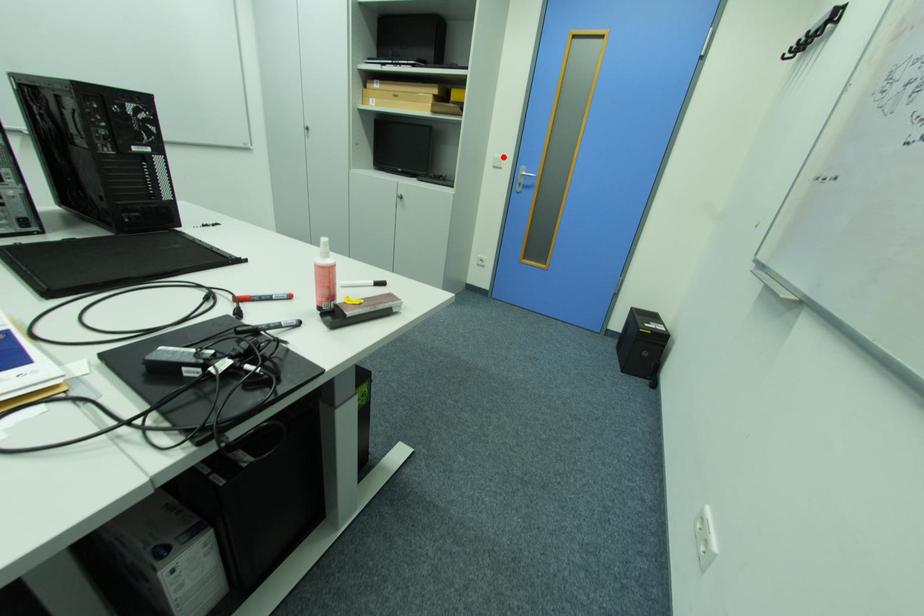
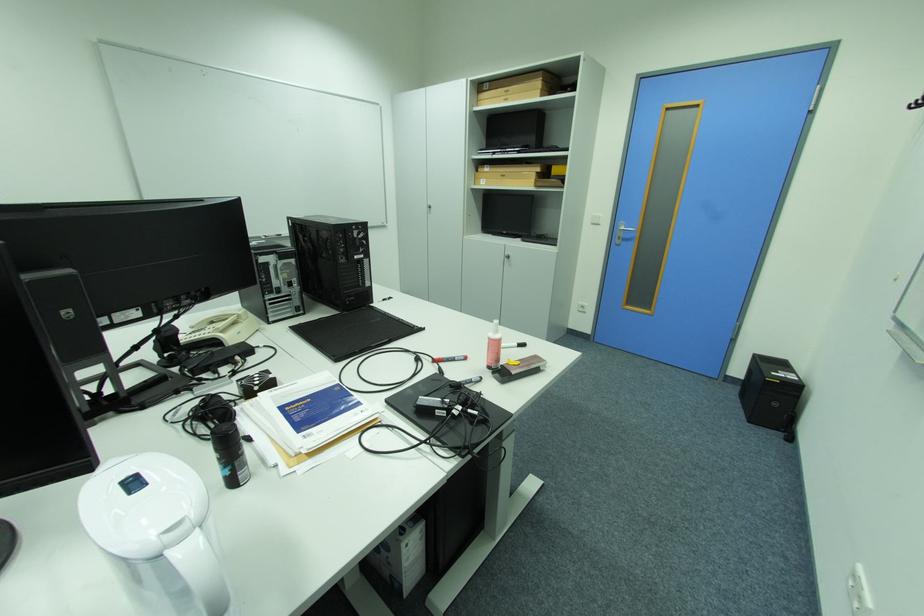
Where in the second image is the point corresponding to the highlighted location from the first image?

(602, 215)